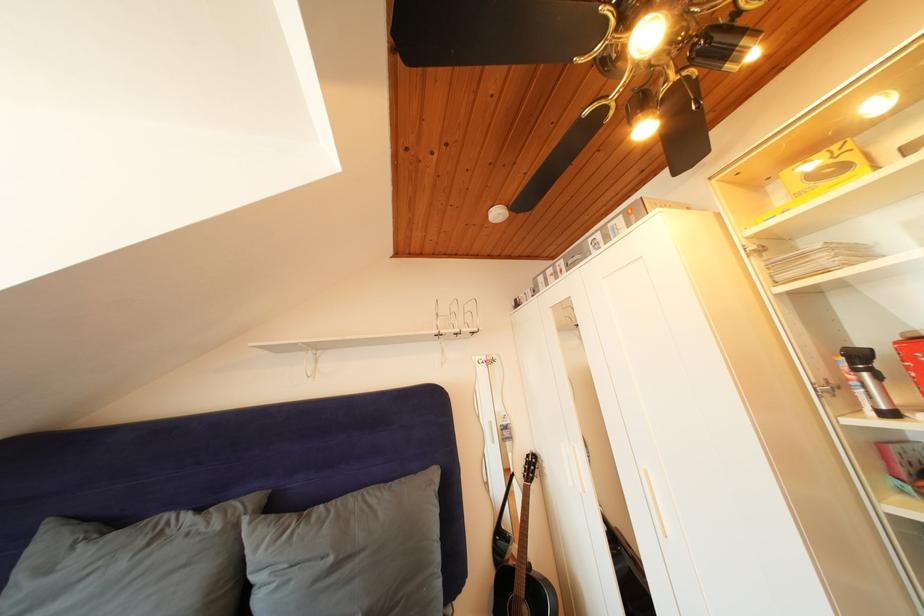
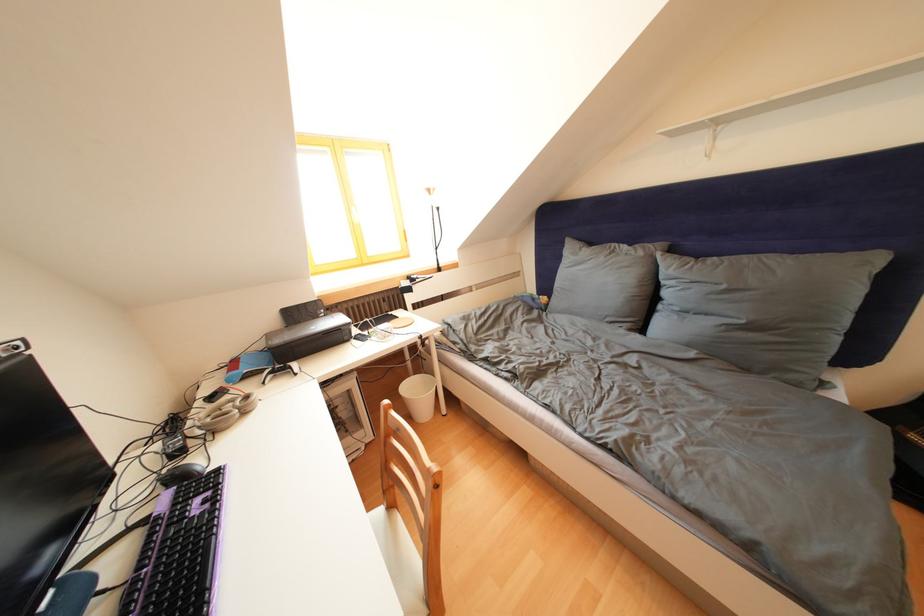
Find the pixel in the second image that matches (x=338, y=565) in the first image.

(733, 292)